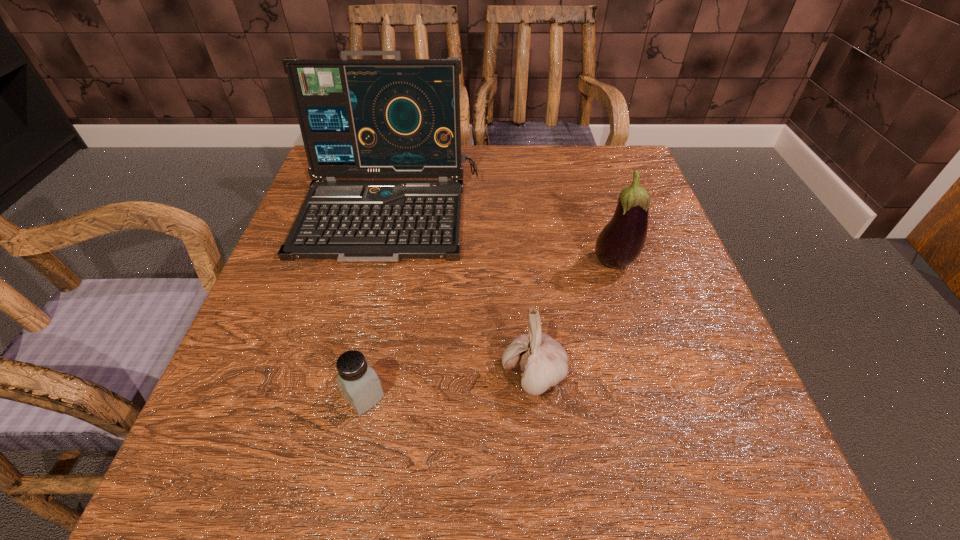
This screenshot has height=540, width=960. In order to click on object that is the nearest to the laptop computer in this screenshot , I will do `click(542, 362)`.

Point out which object is positioned as the third nearest to the eggplant. Please provide its 2D coordinates. Your answer should be formatted as a tuple, i.e. [(x, y)], where the tuple contains the x and y coordinates of a point satisfying the conditions above.

[(359, 385)]

Find the location of a particular element. The width and height of the screenshot is (960, 540). free region that satisfies the following two spatial constraints: 1. on the front-facing side of the laptop computer; 2. on the right side of the garlic is located at coordinates (352, 376).

Where is `blank area in the image that satisfies the following two spatial constraints: 1. on the front-facing side of the laptop computer; 2. on the right side of the eggplant`? blank area in the image that satisfies the following two spatial constraints: 1. on the front-facing side of the laptop computer; 2. on the right side of the eggplant is located at coordinates (378, 264).

Where is `blank space that satisfies the following two spatial constraints: 1. on the front-facing side of the shortest object; 2. on the left side of the laptop computer`? This screenshot has height=540, width=960. blank space that satisfies the following two spatial constraints: 1. on the front-facing side of the shortest object; 2. on the left side of the laptop computer is located at coordinates (348, 397).

Where is `vacant position in the image that satisfies the following two spatial constraints: 1. on the back side of the second tallest object; 2. on the right side of the shortest object`? This screenshot has width=960, height=540. vacant position in the image that satisfies the following two spatial constraints: 1. on the back side of the second tallest object; 2. on the right side of the shortest object is located at coordinates (390, 264).

This screenshot has height=540, width=960. I want to click on vacant space that satisfies the following two spatial constraints: 1. on the front-facing side of the laptop computer; 2. on the left side of the second shortest object, so click(x=352, y=376).

Locate an element on the screen. The height and width of the screenshot is (540, 960). vacant space that satisfies the following two spatial constraints: 1. on the front-facing side of the tallest object; 2. on the left side of the eggplant is located at coordinates (378, 264).

Locate an element on the screen. The width and height of the screenshot is (960, 540). vacant space that satisfies the following two spatial constraints: 1. on the front-facing side of the saltshaker; 2. on the right side of the laptop computer is located at coordinates pos(348,397).

Locate an element on the screen. vacant region that satisfies the following two spatial constraints: 1. on the front-facing side of the garlic; 2. on the left side of the tallest object is located at coordinates (352, 376).